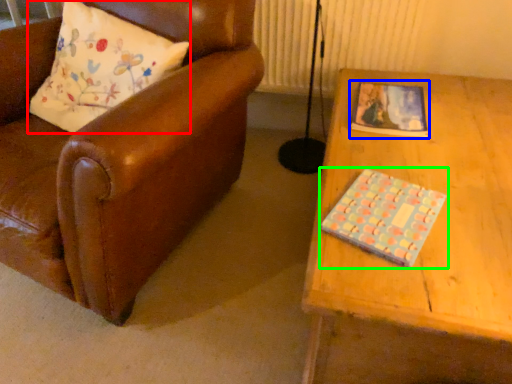
Question: Estimate the real-world distances between objects in this image. Which object is closer to pillow (highlighted by a red box), book (highlighted by a blue box) or book (highlighted by a green box)?

Choices:
 (A) book
 (B) book

Answer: (A)